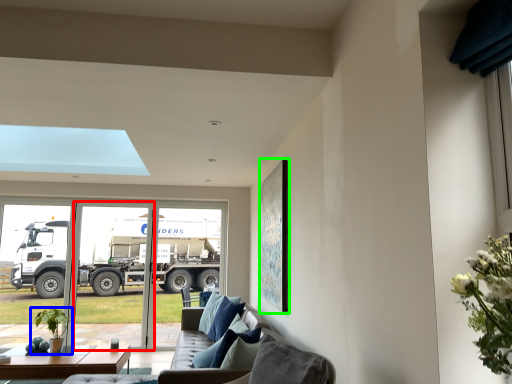
Question: Considering the real-world distances, which object is farthest from screen door (highlighted by a red box)? houseplant (highlighted by a blue box) or picture frame (highlighted by a green box)?

Choices:
 (A) houseplant
 (B) picture frame

Answer: (B)